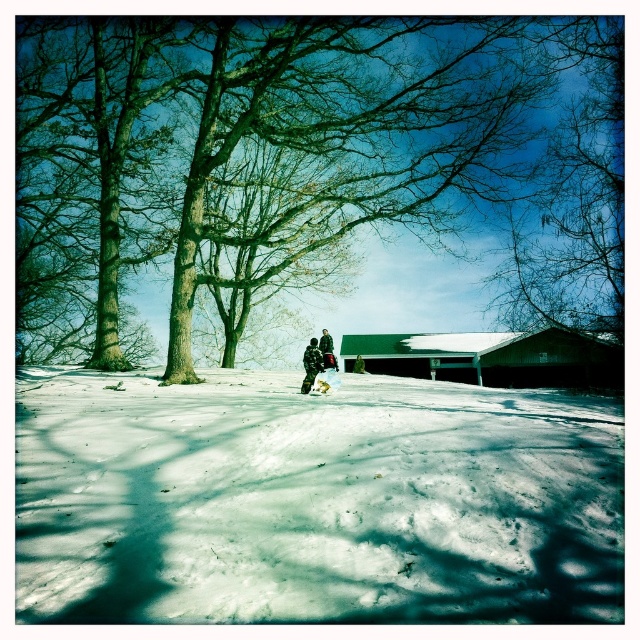
Question: Which point is farther to the camera?

Choices:
 (A) (312, 145)
 (B) (304, 360)
 (C) (316, 385)
 (D) (148, 419)

Answer: (A)

Question: Is snowy camouflage jacket at center to the left of white matte snowboard at center from the viewer's perspective?

Choices:
 (A) yes
 (B) no

Answer: (A)

Question: Is green bark tree at center positioned at the back of snowy camouflage jacket at center?

Choices:
 (A) yes
 (B) no

Answer: (B)

Question: Which object is positioned farthest from the green bark tree at center?

Choices:
 (A) white matte snowboard at center
 (B) snowy camouflage jacket at center

Answer: (A)

Question: Which object is the farthest from the white matte snowboard at center?

Choices:
 (A) snowy camouflage jacket at center
 (B) white powdery snow at center

Answer: (B)

Question: Where is white powdery snow at center located in relation to green bark tree at center in the image?

Choices:
 (A) left
 (B) right

Answer: (B)